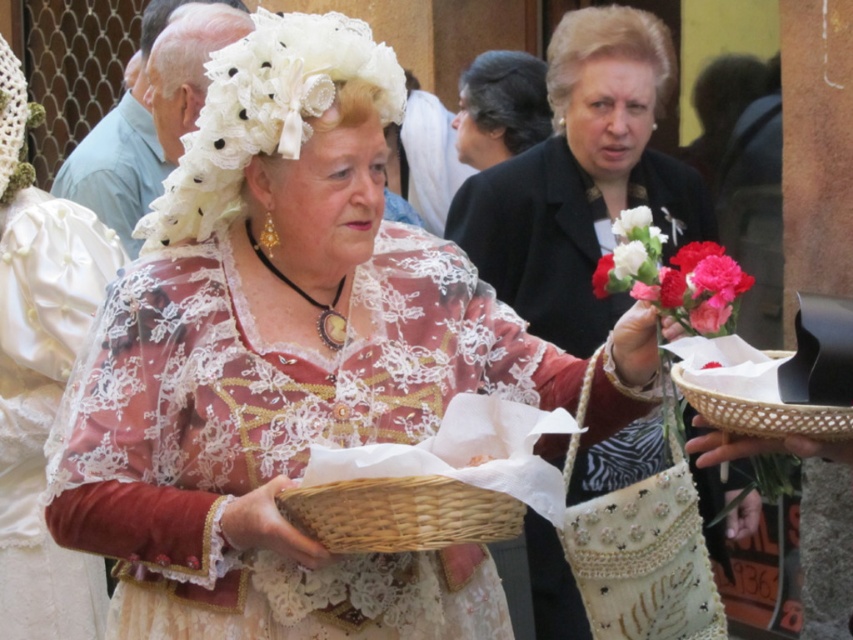
Question: Which object appears closest to the camera in this image?

Choices:
 (A) woven wicker basket at center
 (B) white lace hat at upper left
 (C) smooth silk bouquet at center
 (D) matte black coat at center

Answer: (A)

Question: Among these points, which one is farthest from the camera?

Choices:
 (A) (18, 497)
 (B) (215, 186)
 (C) (776, 419)

Answer: (A)

Question: Considering the relative positions of white lace hat at upper left and smooth silk bouquet at center in the image provided, where is white lace hat at upper left located with respect to smooth silk bouquet at center?

Choices:
 (A) above
 (B) below

Answer: (B)

Question: Among these objects, which one is nearest to the camera?

Choices:
 (A) lace fabric dress at center
 (B) smooth silk bouquet at center
 (C) white lace headdress at upper center

Answer: (B)

Question: From the image, what is the correct spatial relationship of lace fabric dress at center in relation to woven wicker basket at center?

Choices:
 (A) left
 (B) right

Answer: (A)

Question: Does matte black coat at center appear over woven wicker basket at center?

Choices:
 (A) no
 (B) yes

Answer: (A)